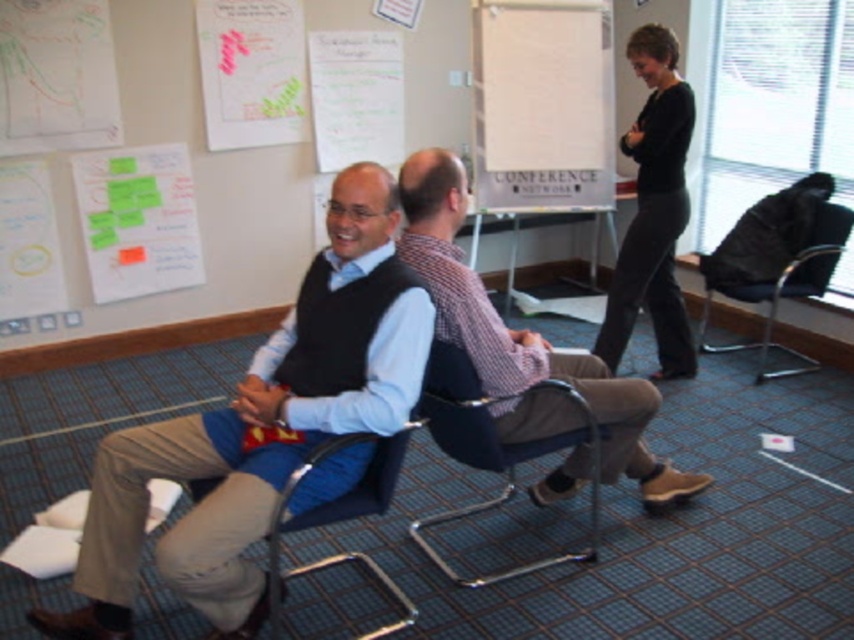
You are a photographer setting up for a group photo in the conference room. You have two points marked on the camera screen at coordinates point (562, 390) and point (285, 522). Which point is closer to the camera?

Point (285, 522) is closer to the camera than point (562, 390).

You are planning to set up a small table between the metallic blue chair at center and the blue fabric chair at center in the meeting room. Which chair should the table be placed closer to if you want the table to be closer to the larger chair?

The metallic blue chair at center is bigger than the blue fabric chair at center, so the table should be placed closer to the metallic blue chair at center to ensure it is near the larger chair.

You are sitting in the blue fabric chair at center and want to hand a document to the person wearing the matte black vest at center. Which direction should you move to reach them?

The matte black vest at center is to the left of the blue fabric chair at center, so you should move to your left to reach them.